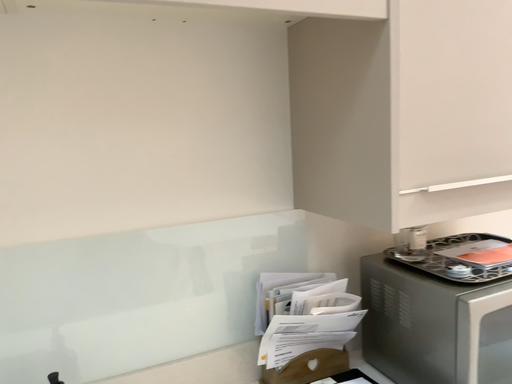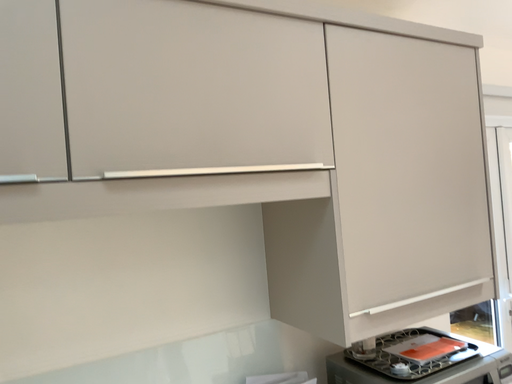
Question: How did the camera likely rotate when shooting the video?

Choices:
 (A) rotated upward
 (B) rotated downward

Answer: (A)